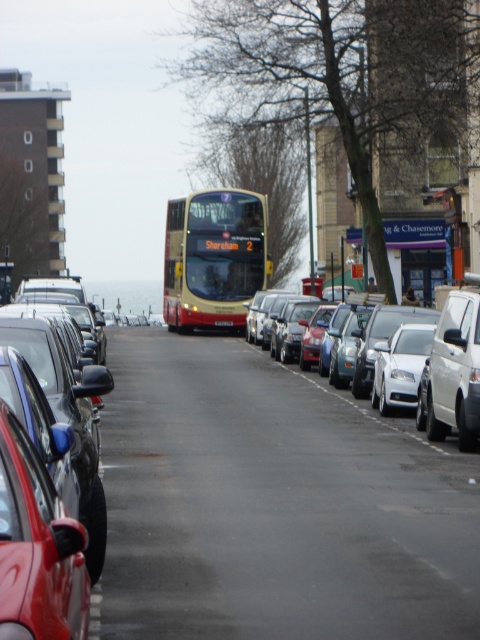
You are standing on the street and see a point marked at coordinates (x=214, y=257). What object is located at that point?

The point at coordinates (x=214, y=257) indicates the gold yellow metallic bus at center.

You are standing on the sidewalk and want to cross the street to the other side. There is a white glossy car at center in your path. Based on its position, do you think the car is moving towards you or away from you?

The white glossy car at center is positioned at point (456,369), which suggests it is moving away from you since it is centered and likely in the middle of the road, moving forward.

You are a pedestrian standing on the sidewalk and want to cross the street to the other side. There are two points marked on the road where you can cross. The first point is at coordinates point (180, 204) and the second point is at point (228, 320). Which point is closer to you as a pedestrian?

Point (180, 204) is closer to you because it is further to the viewer than point (228, 320), meaning it is nearer in the scene.